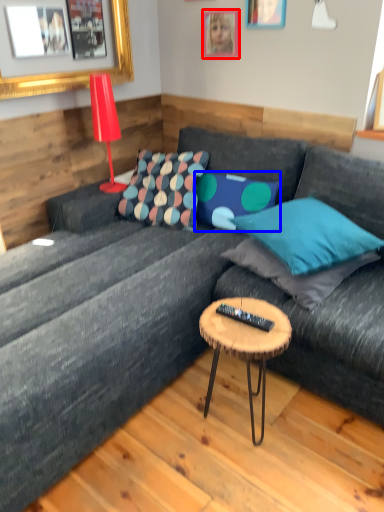
Question: Which object appears farthest to the camera in this image, picture frame (highlighted by a red box) or pillow (highlighted by a blue box)?

Choices:
 (A) picture frame
 (B) pillow

Answer: (A)